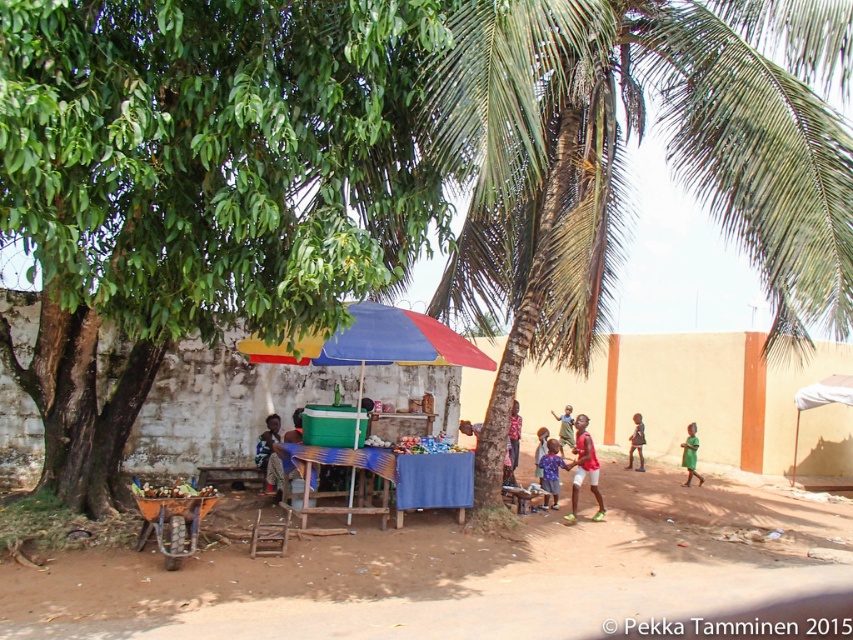
You are a photographer standing in the middle of the scene. You want to take a picture of the white cotton shirt at center without the brown dirt field at center appearing in the frame. Is it possible to do so by moving only to your left or right?

The brown dirt field at center is positioned on the left side of white cotton shirt at center. Therefore, if you move to your right, you can position yourself so that the dirt field is out of the frame while keeping the white cotton shirt at center in view.

You are a customer at the market stall and want to buy clothing items. You see the white cotton shirt at center and the green fabric dress at lower right. Which clothing item is bigger in size?

The white cotton shirt at center is larger in size compared to the green fabric dress at lower right.